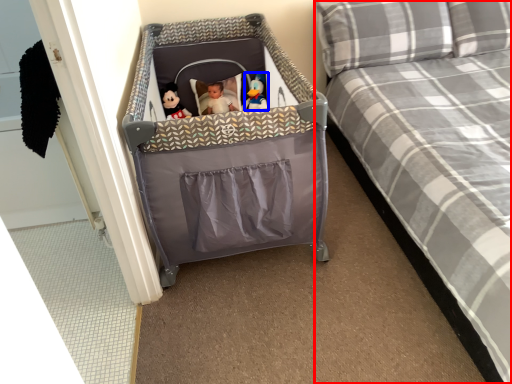
Question: Which of the following is the closest to the observer, bed (highlighted by a red box) or toy (highlighted by a blue box)?

Choices:
 (A) bed
 (B) toy

Answer: (A)